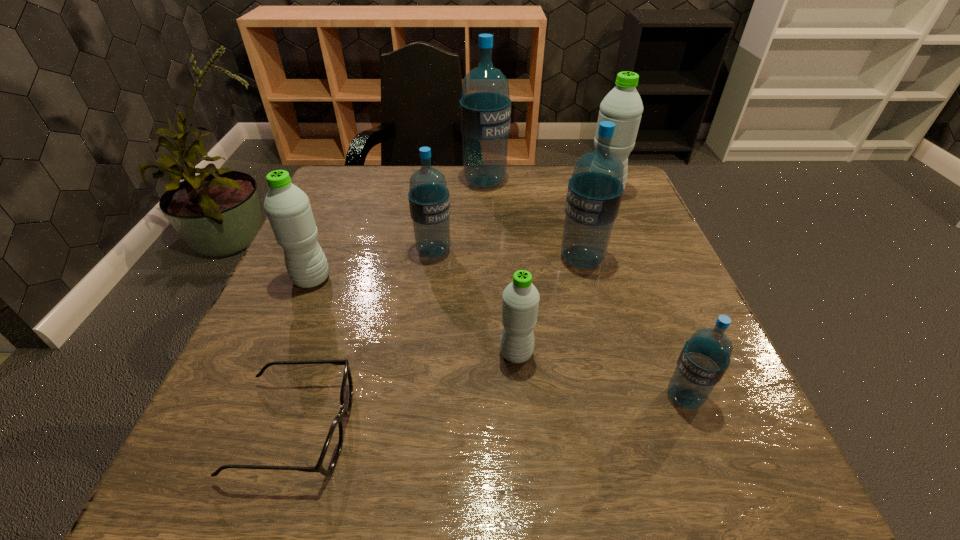
Where is `vacant space located 0.070m on the front of the smallest blue water bottle`? This screenshot has width=960, height=540. vacant space located 0.070m on the front of the smallest blue water bottle is located at coordinates (708, 460).

Identify the location of blank space located on the back of the sixth farthest object. Image resolution: width=960 pixels, height=540 pixels. (507, 228).

Locate an element on the screen. free spot located on the front-facing side of the spectacles is located at coordinates (498, 429).

Where is `object present at the near edge`? The height and width of the screenshot is (540, 960). object present at the near edge is located at coordinates (332, 447).

At what (x,y) coordinates should I click in order to perform the action: click on water bottle present at the left edge. Please return your answer as a coordinate pair (x, y). The height and width of the screenshot is (540, 960). Looking at the image, I should click on (287, 207).

In order to click on spectacles that is positioned at the left edge in this screenshot , I will do `click(332, 447)`.

The width and height of the screenshot is (960, 540). I want to click on object located at the near left corner, so click(332, 447).

Where is `object that is at the far right corner`? The image size is (960, 540). object that is at the far right corner is located at coordinates (623, 106).

In the image, there is a desktop. Where is `free space at the far edge`? free space at the far edge is located at coordinates (526, 186).

The width and height of the screenshot is (960, 540). In the image, there is a desktop. Identify the location of free space at the near edge. (564, 473).